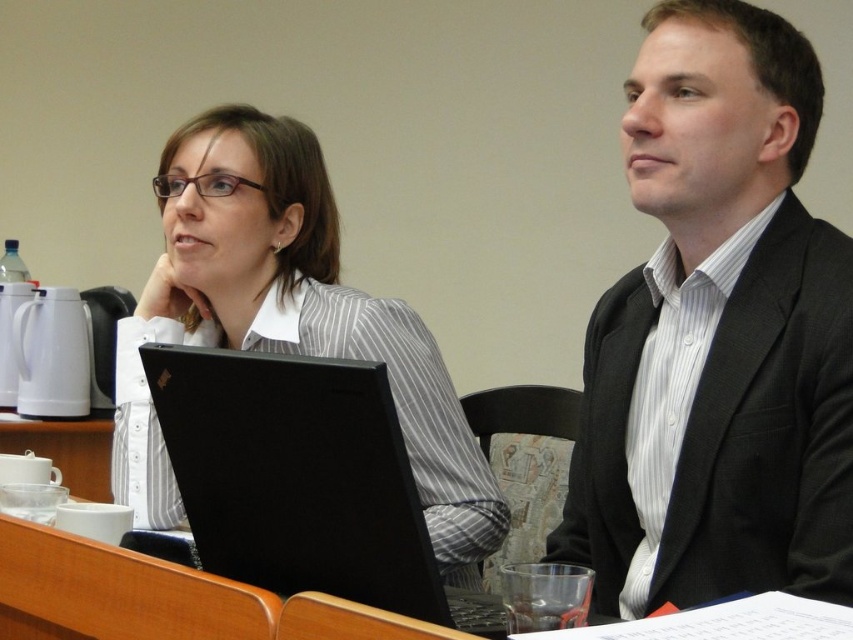
Locate an element on the screen. This screenshot has width=853, height=640. black textured suit at center is located at coordinates (718, 333).

Describe the element at coordinates (718, 333) in the screenshot. I see `black textured suit at center` at that location.

This screenshot has height=640, width=853. What are the coordinates of `black textured suit at center` in the screenshot? It's located at (718, 333).

Which is below, black textured suit at center or white striped shirt at center?

white striped shirt at center

Is black textured suit at center shorter than white striped shirt at center?

Yes.

Which is behind, point (808, 321) or point (206, 339)?

Point (206, 339)

You are a GUI agent. You are given a task and a screenshot of the screen. Output one action in this format:
    pyautogui.click(x=<x>, y=<y>)
    Task: Click on the black textured suit at center
    
    Given the screenshot: What is the action you would take?
    pyautogui.click(x=718, y=333)

Who is positioned more to the right, white striped shirt at center or black matte laptop at center?

Positioned to the right is black matte laptop at center.

Is white striped shirt at center positioned at the back of black matte laptop at center?

Yes, it is behind black matte laptop at center.

Where is `white striped shirt at center`? This screenshot has width=853, height=640. white striped shirt at center is located at coordinates (308, 301).